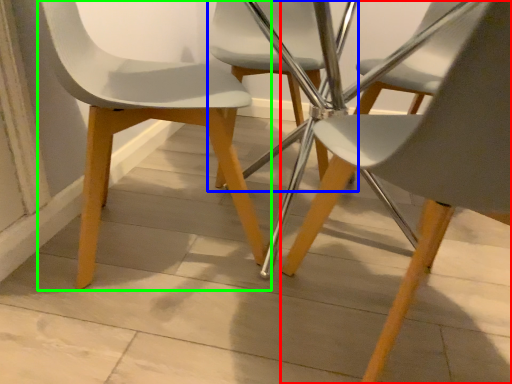
Question: Based on their relative distances, which object is nearer to chair (highlighted by a red box)? Choose from chair (highlighted by a blue box) and chair (highlighted by a green box).

Choices:
 (A) chair
 (B) chair

Answer: (B)